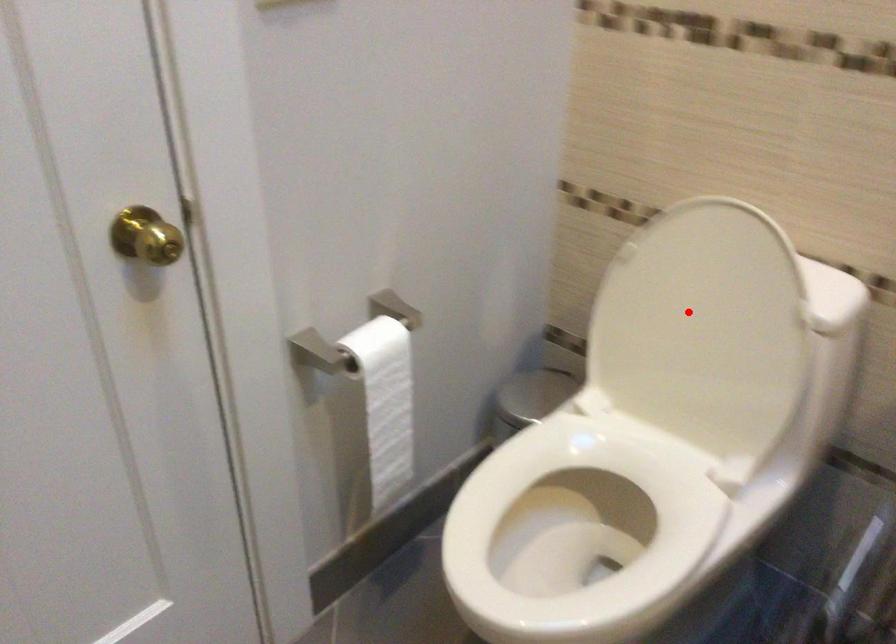
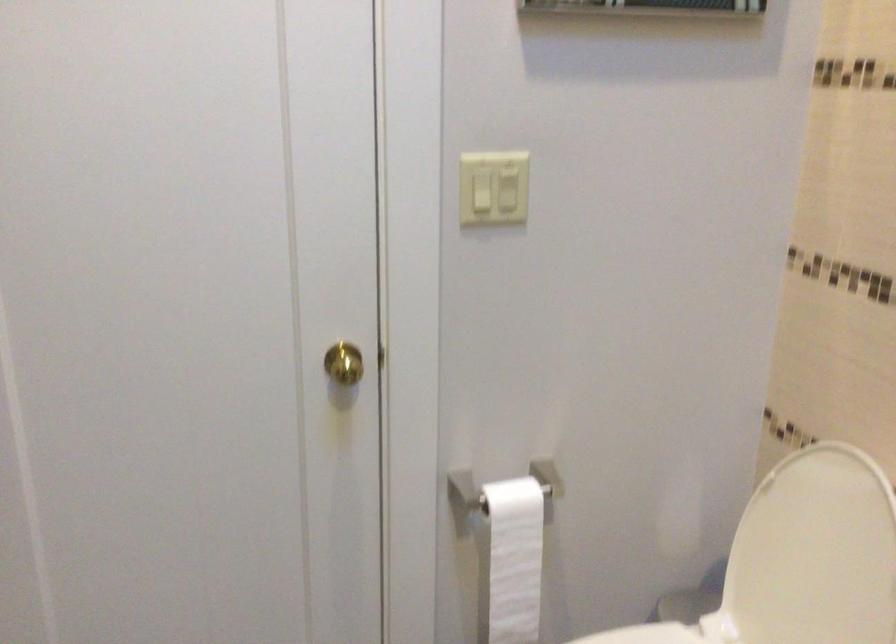
Find the pixel in the second image that matches the highlighted location in the first image.

(813, 554)